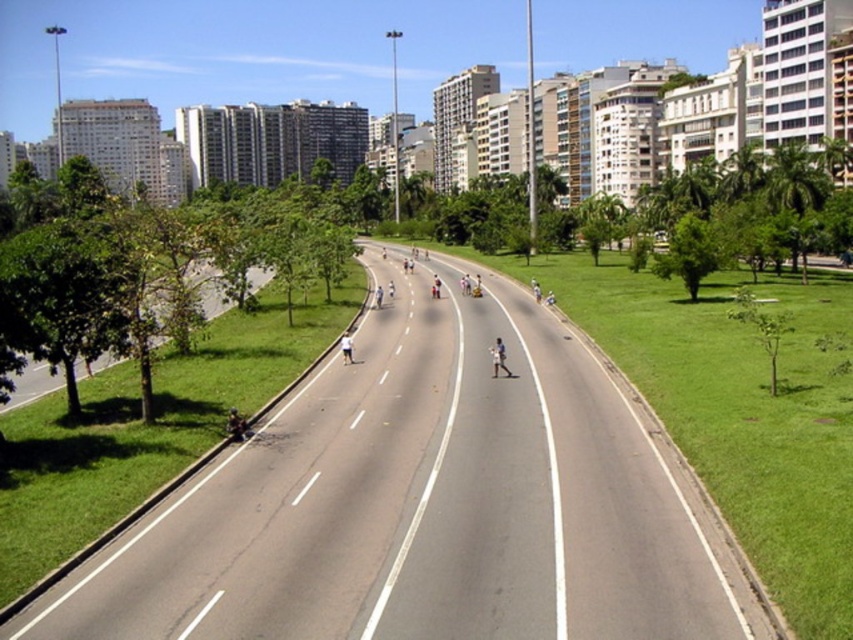
Question: Does smooth asphalt road at center appear under white matte person at center?

Choices:
 (A) yes
 (B) no

Answer: (A)

Question: Which point is closer to the camera?

Choices:
 (A) (239, 436)
 (B) (505, 369)

Answer: (A)

Question: Which object appears farthest from the camera in this image?

Choices:
 (A) dark green fabric at center
 (B) smooth asphalt road at center

Answer: (A)

Question: Does dark green fabric at center have a greater width compared to white matte person at center?

Choices:
 (A) yes
 (B) no

Answer: (B)

Question: Is smooth asphalt road at center thinner than dark green fabric at center?

Choices:
 (A) no
 (B) yes

Answer: (A)

Question: Based on their relative distances, which object is farther from the white matte person at center?

Choices:
 (A) smooth asphalt road at center
 (B) dark green fabric at center

Answer: (B)